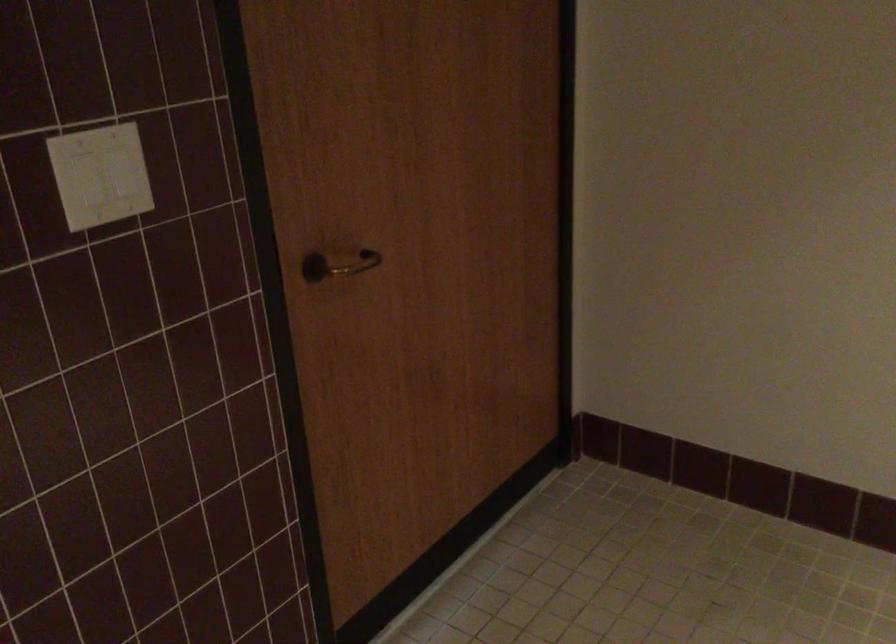
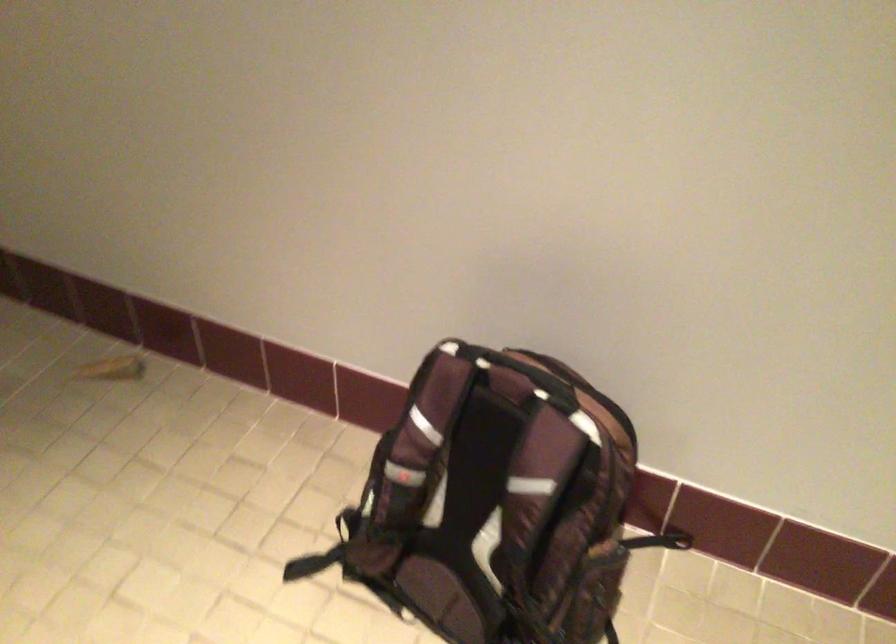
Question: In a continuous first-person perspective shot, in which direction is the camera moving?

Choices:
 (A) Left
 (B) Right
 (C) Forward
 (D) Backward

Answer: (B)